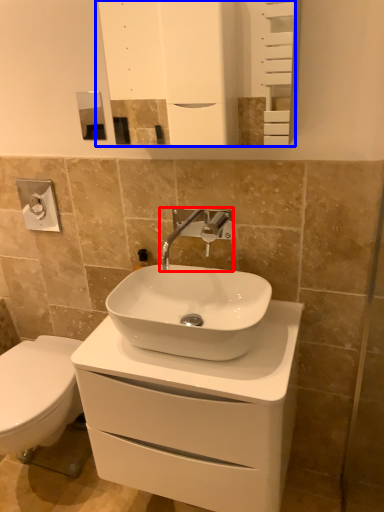
Question: Which of the following is the farthest to the observer, tap (highlighted by a red box) or mirror (highlighted by a blue box)?

Choices:
 (A) tap
 (B) mirror

Answer: (A)